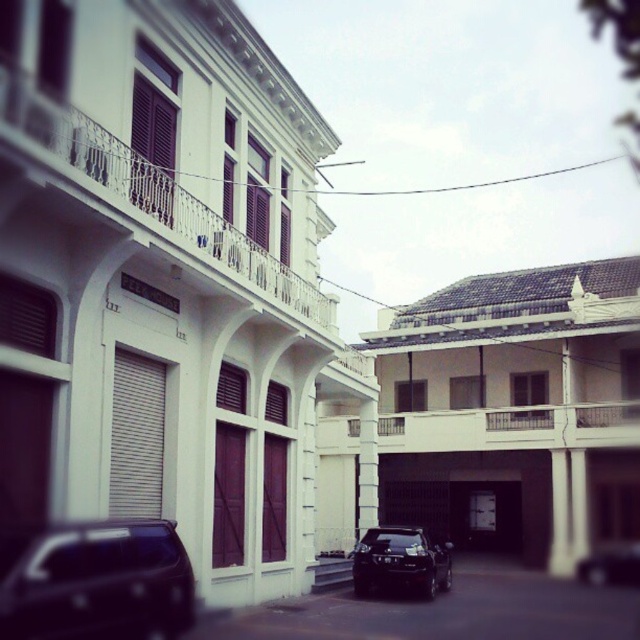
Question: Which object appears closest to the camera in this image?

Choices:
 (A) dark matte car at lower left
 (B) shiny black suv at center

Answer: (A)

Question: Can you confirm if dark matte car at lower left is positioned to the left of shiny black suv at center?

Choices:
 (A) yes
 (B) no

Answer: (A)

Question: Which point is closer to the camera taking this photo?

Choices:
 (A) (372, 529)
 (B) (166, 625)

Answer: (B)

Question: Is the position of dark matte car at lower left less distant than that of shiny black suv at center?

Choices:
 (A) no
 (B) yes

Answer: (B)

Question: From the image, what is the correct spatial relationship of dark matte car at lower left in relation to shiny black suv at center?

Choices:
 (A) below
 (B) above

Answer: (B)